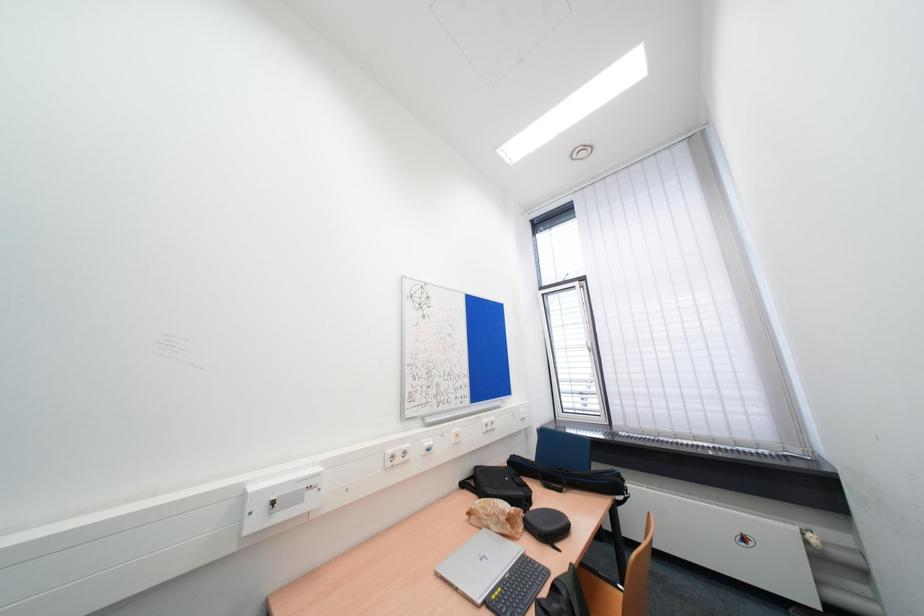
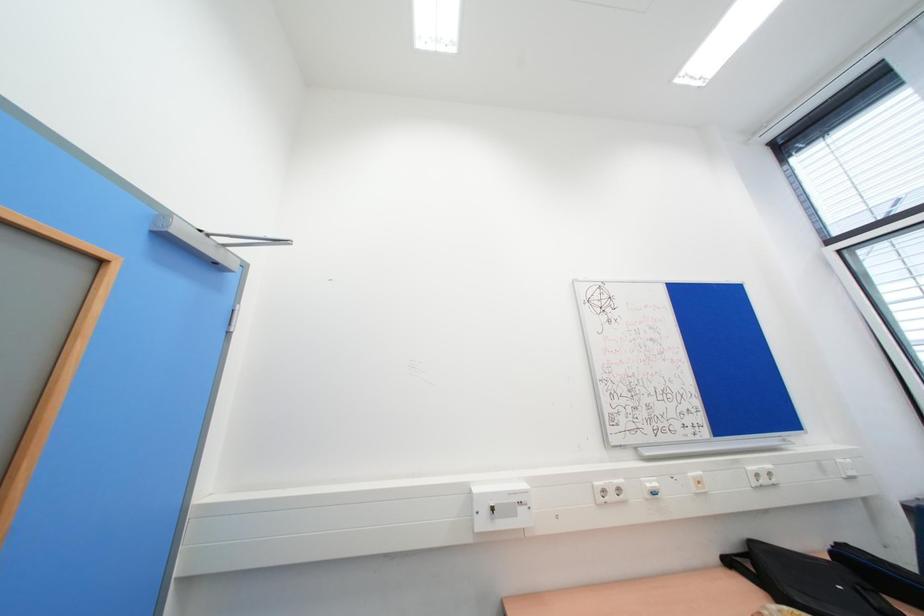
Question: The first image is from the beginning of the video and the second image is from the end. How did the camera likely rotate when shooting the video?

Choices:
 (A) Left
 (B) Right
 (C) Up
 (D) Down

Answer: (A)